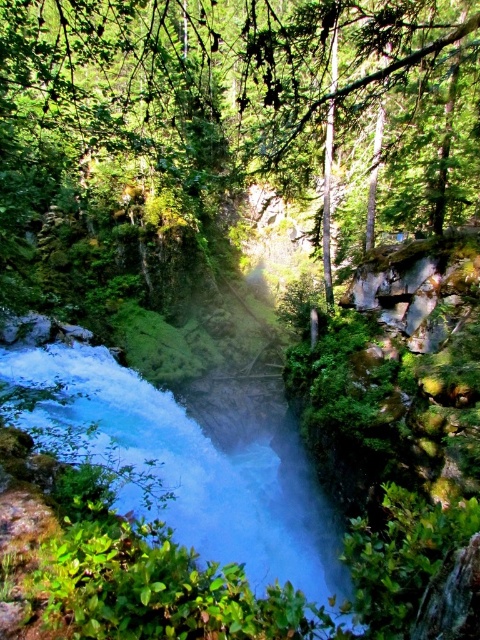
You are a hiker trying to cross the forest path. You see a green leafy tree at center and a white frothy water at center. Which object is located to the left of the other?

The green leafy tree at center is positioned on the left side of white frothy water at center.

You are a hiker who wants to cross the forest to reach the waterfall. You have a rope that is 30 feet long. The green leafy tree at center has a sturdy branch. Can you use the rope to safely reach the white frothy water at center from the tree?

The distance between the green leafy tree at center and the white frothy water at center is 29.11 feet. Since your rope is 30 feet long, it is long enough to safely reach the white frothy water at center from the tree.

You are a hiker navigating through the forest and want to reach the waterfall. You see two landmarks marked as point (355,100) and point (52,449). Which point should you head towards first to get closer to the waterfall?

You should head towards point (52,449) first because point (355,100) is behind it, meaning point (52,449) is closer to your current position.